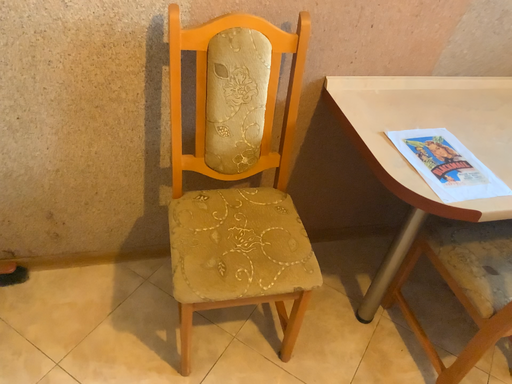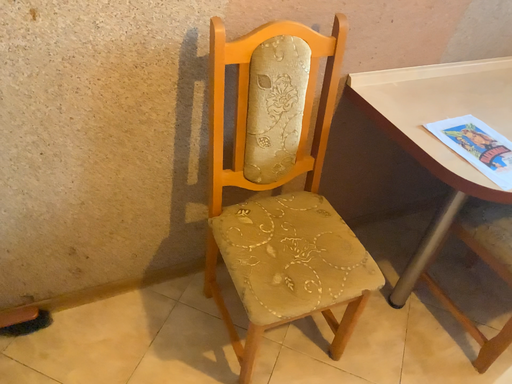
Question: How did the camera likely rotate when shooting the video?

Choices:
 (A) rotated left
 (B) rotated right

Answer: (B)